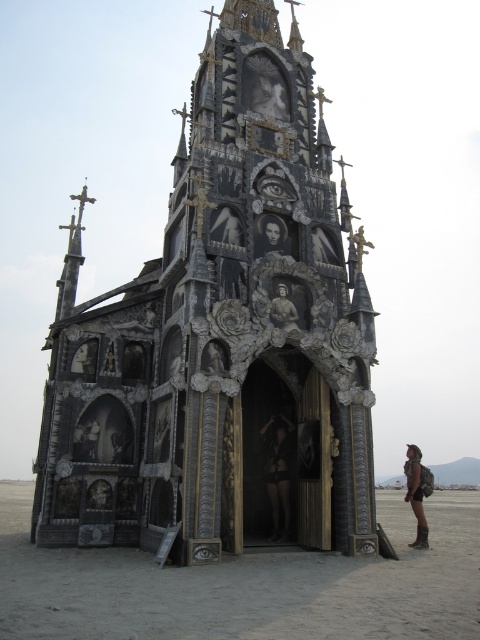
You are an architect assessing the space requirements for a new sculpture garden. The garden must accommodate both the black wood church at center and the smooth bronze statue at center. Based on the scene, which object requires more horizontal space due to its width?

The black wood church at center might be wider than smooth bronze statue at center, so it likely requires more horizontal space.

Looking at this image, you are an interior designer planning to place a decorative item in the center of the gothic chapel. You have the black leather pants at center and the smooth black portrait at center. Which item will require more horizontal space to display properly?

The smooth black portrait at center requires more horizontal space because its width is greater than the black leather pants at center.